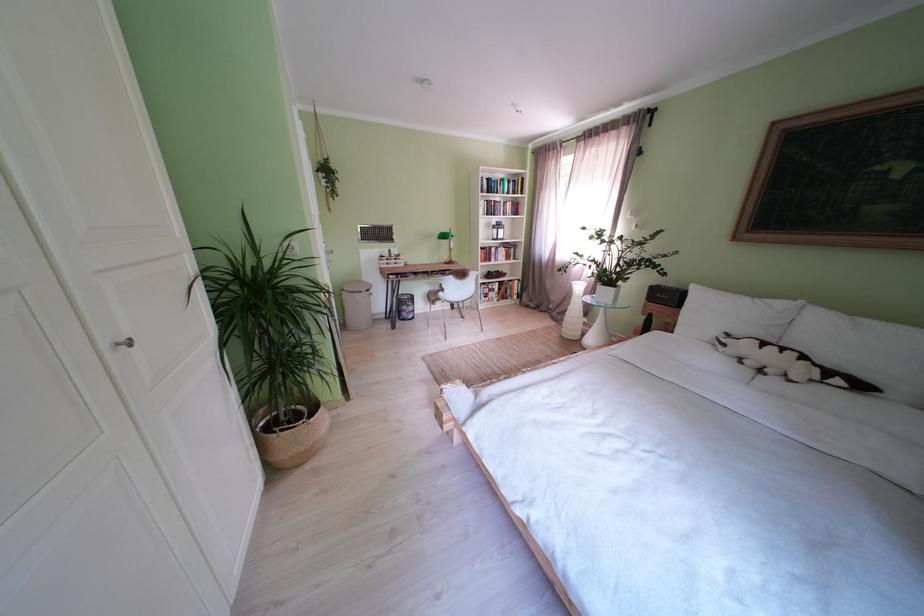
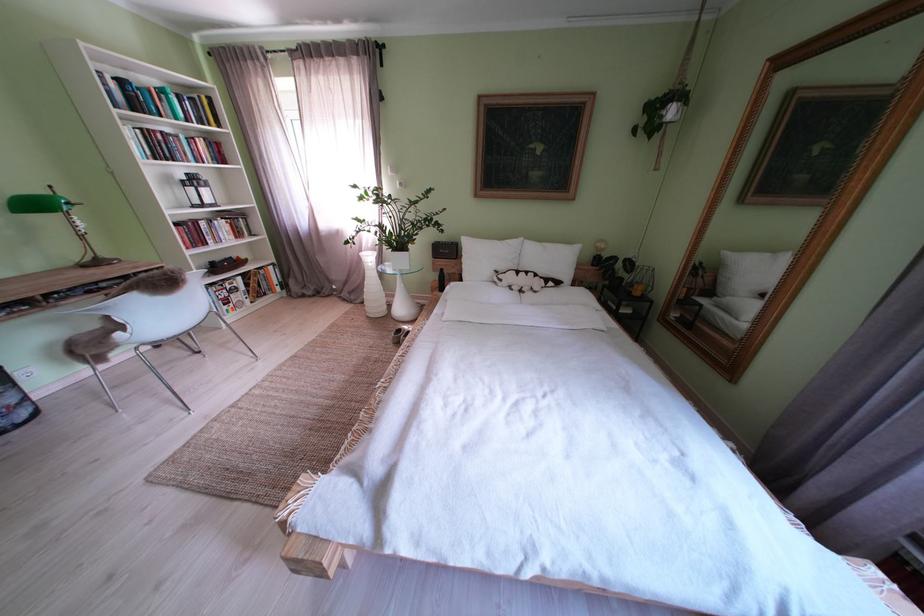
Find the pixel in the second image that matches (x=735, y=350) in the first image.

(512, 285)